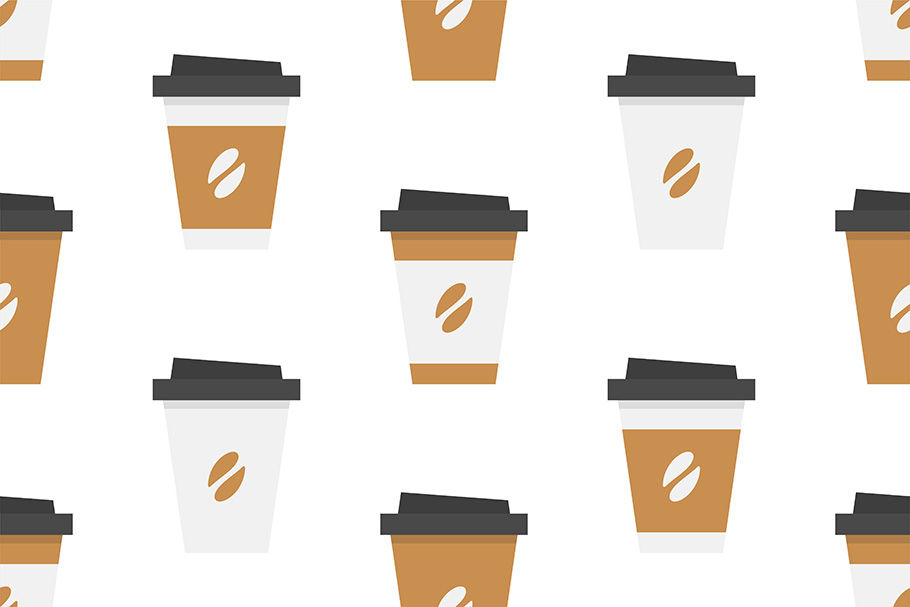
Locate an element on the screen. The height and width of the screenshot is (607, 910). coffee cups with brown coffee bean logo is located at coordinates (x=7, y=595), (x=225, y=479), (x=461, y=316), (x=901, y=600), (x=675, y=164), (x=902, y=19), (x=8, y=11).